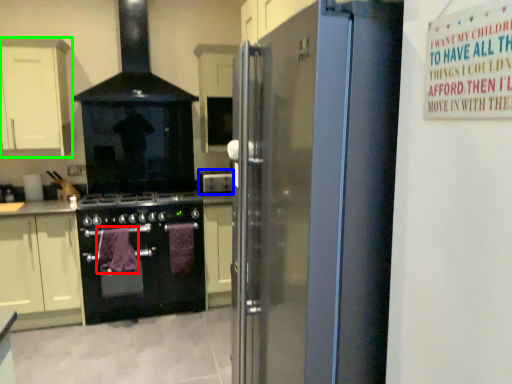
Question: Considering the real-world distances, which object is farthest from blanket (highlighted by a red box)? appliance (highlighted by a blue box) or cabinetry (highlighted by a green box)?

Choices:
 (A) appliance
 (B) cabinetry

Answer: (B)